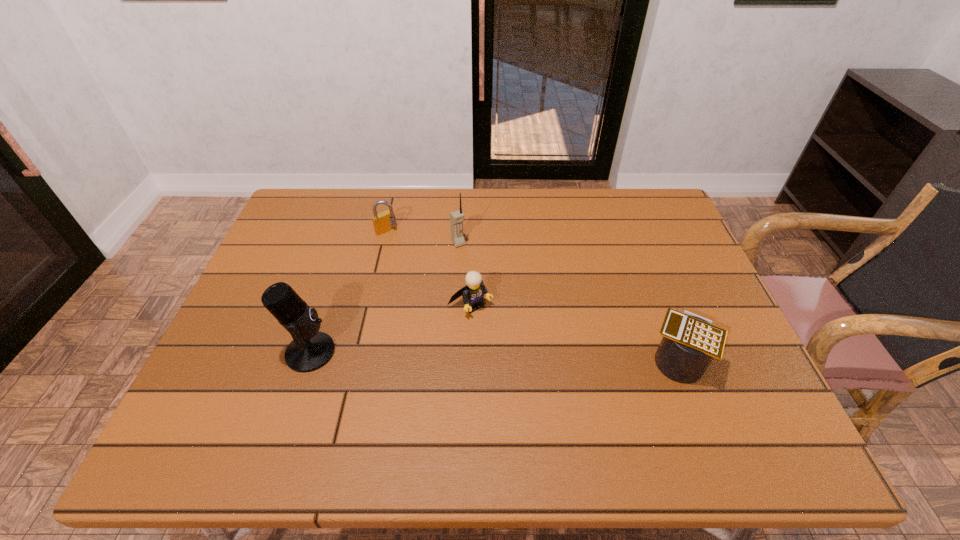
Where is `object that is at the near edge`? The image size is (960, 540). object that is at the near edge is located at coordinates (690, 342).

Identify the location of object located in the left edge section of the desktop. (310, 349).

Identify the location of object that is at the right edge. (690, 342).

Where is `object at the near right corner`? The image size is (960, 540). object at the near right corner is located at coordinates (690, 342).

The height and width of the screenshot is (540, 960). In the image, there is a desktop. Find the location of `vacant space at the far edge`. vacant space at the far edge is located at coordinates (361, 228).

In the image, there is a desktop. Identify the location of free space at the near edge. (378, 389).

Where is `vacant region at the left edge of the desktop`? The image size is (960, 540). vacant region at the left edge of the desktop is located at coordinates (279, 363).

The height and width of the screenshot is (540, 960). In the image, there is a desktop. Find the location of `vacant space at the right edge`. vacant space at the right edge is located at coordinates (720, 315).

Find the location of `vacant area at the far left corner of the desktop`. vacant area at the far left corner of the desktop is located at coordinates (x=335, y=212).

Identify the location of vacant region at the far right corner. (644, 231).